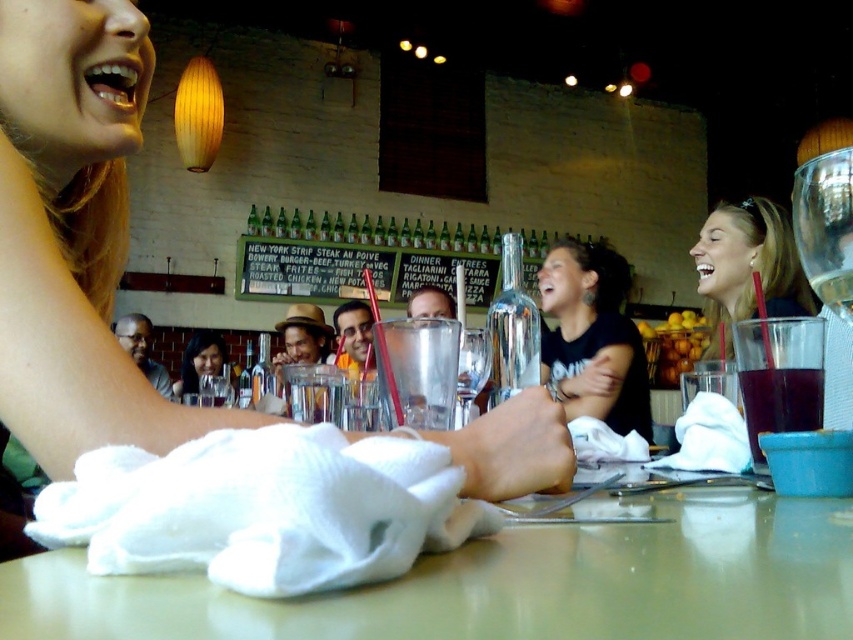
Question: Which point is closer to the camera taking this photo?

Choices:
 (A) (115, 157)
 (B) (196, 380)

Answer: (A)

Question: Can you confirm if white fabric at center is smaller than matte black hair at center?

Choices:
 (A) no
 (B) yes

Answer: (B)

Question: Does white fabric at center appear under matte black hair at upper right?

Choices:
 (A) no
 (B) yes

Answer: (B)

Question: Among these objects, which one is farthest from the camera?

Choices:
 (A) white fabric at center
 (B) translucent plastic cup at lower right
 (C) matte black hair at center

Answer: (C)

Question: Is matte black hair at upper right to the left of translucent plastic cup at lower right from the viewer's perspective?

Choices:
 (A) no
 (B) yes

Answer: (A)

Question: Which point is closer to the camera taking this photo?

Choices:
 (A) (221, 362)
 (B) (88, 605)
 (C) (483, 490)
 (D) (747, 401)

Answer: (B)